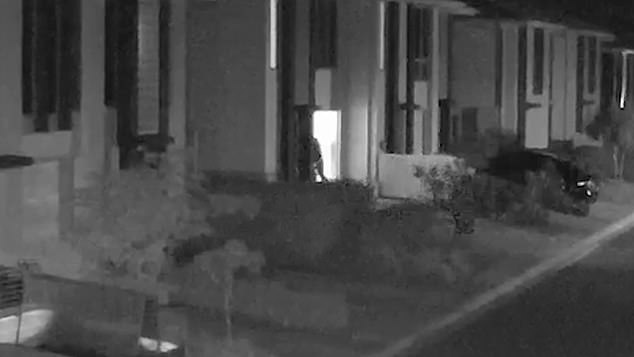
Where is `lighting`? This screenshot has width=634, height=357. lighting is located at coordinates (622, 104).